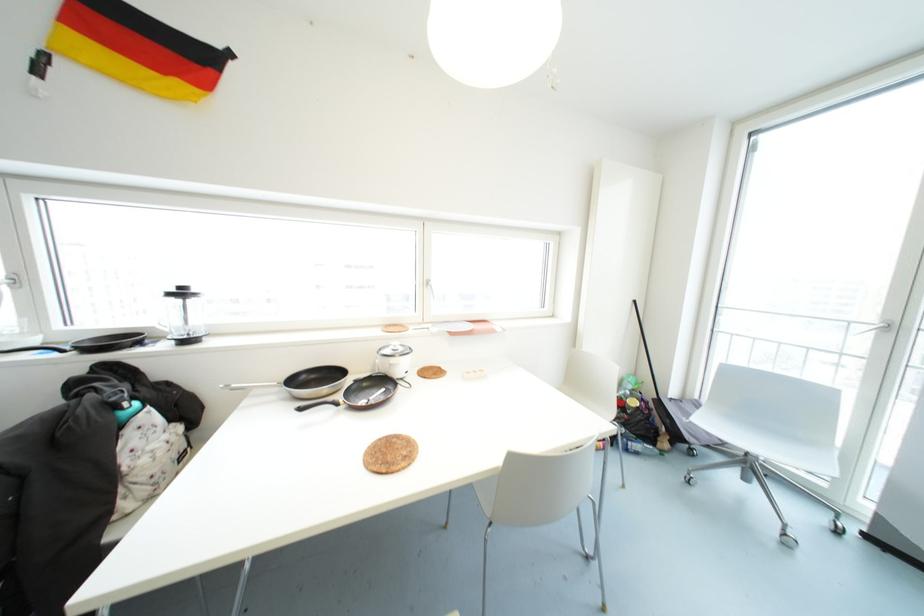
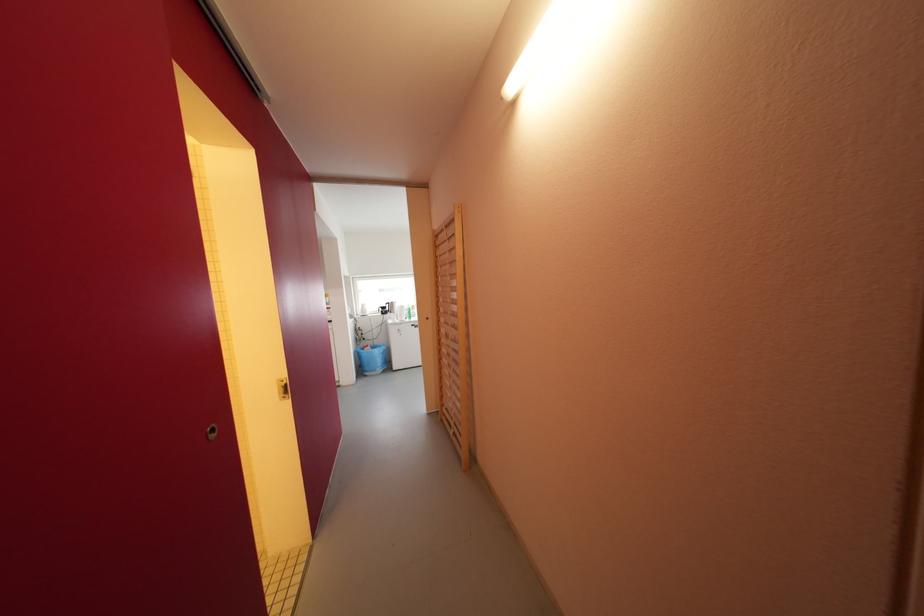
Question: What movement of the cameraman would produce the second image?

Choices:
 (A) Left
 (B) Right
 (C) Forward
 (D) Backward

Answer: (D)